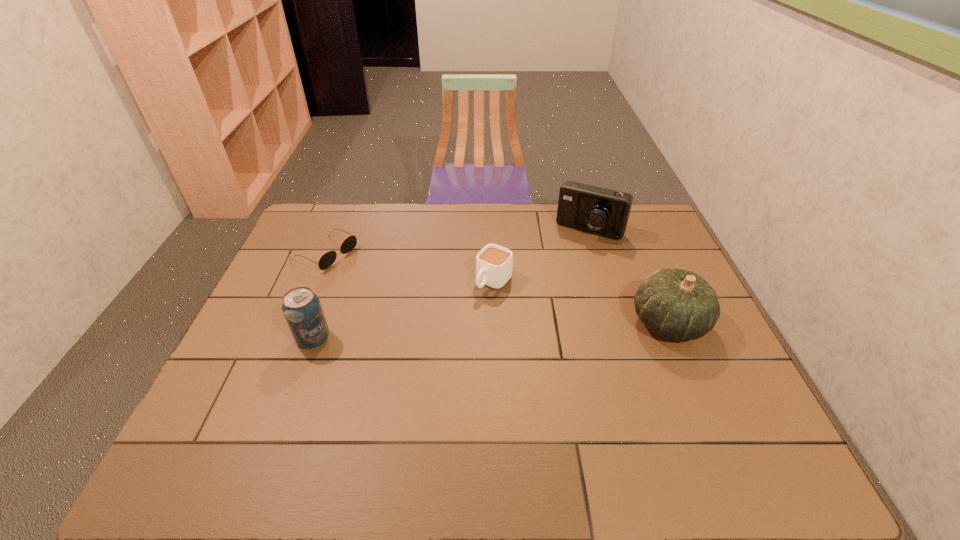
At what (x,y) coordinates should I click in order to perform the action: click on object that is the closest one to the pop soda. Please return your answer as a coordinate pair (x, y). Looking at the image, I should click on (327, 259).